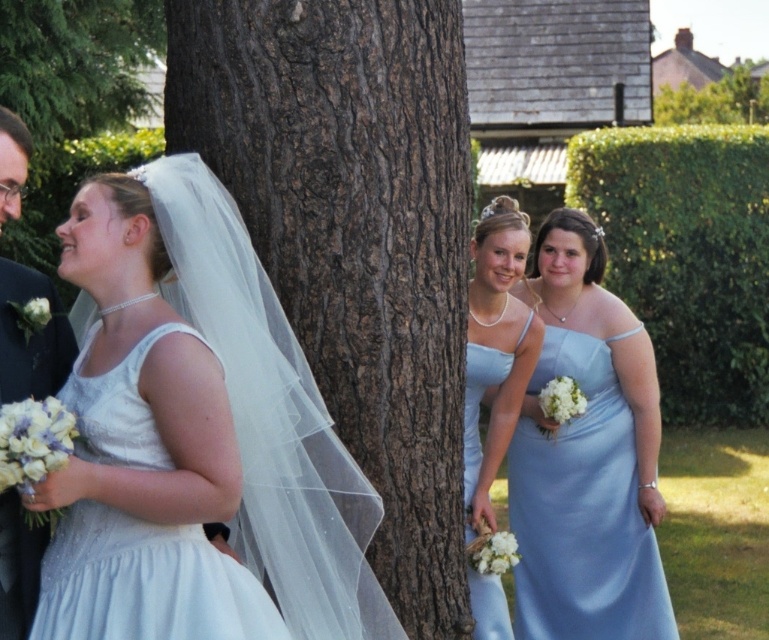
You are a photographer adjusting your camera focus. You need to focus on two points in the image, point (x=544, y=534) and point (x=65, y=632). Which point should you focus on first if you want to start with the one closer to you?

Point (x=544, y=534) is closer to you than point (x=65, y=632), so you should focus on point (x=544, y=534) first.

You are a photographer at the wedding and want to capture a photo that includes both the light blue satin dress at center and the matte black suit at left. Which one should you focus on first to ensure they are both in sharp focus?

The light blue satin dress at center is closer to the viewer than the matte black suit at left, so focusing on the light blue satin dress at center first will ensure both are in focus.

You are a photographer standing in front of the brown rough bark at center and the matte black suit at left. Which object is closer to you?

The brown rough bark at center is closer to you since it is further to the viewer than the matte black suit at left.